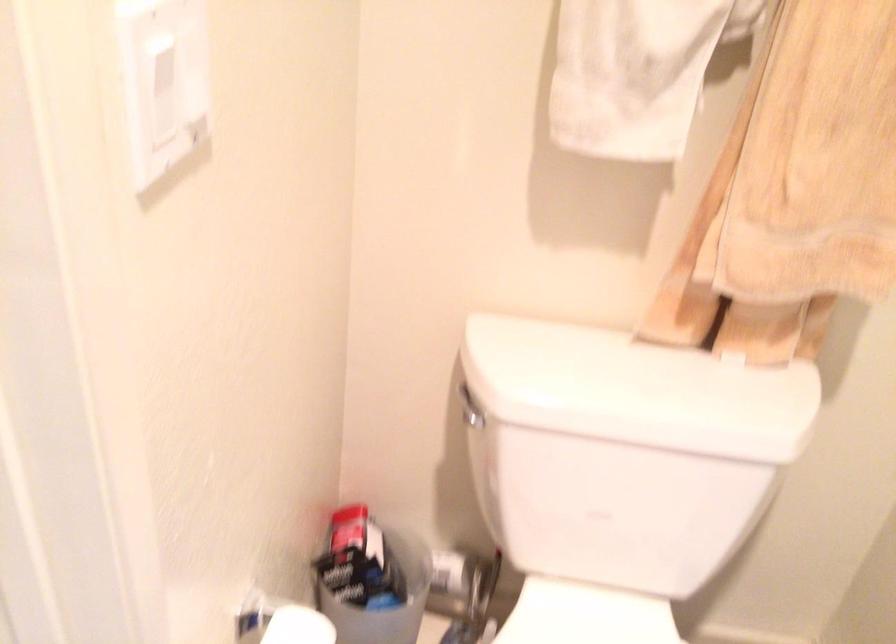
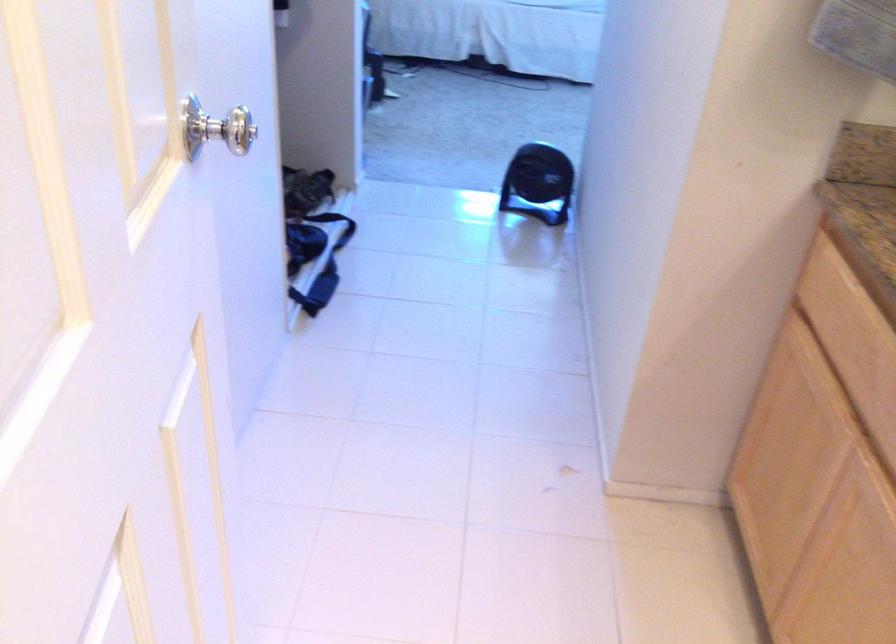
How did the camera likely rotate?

The camera's rotation is toward left-down.